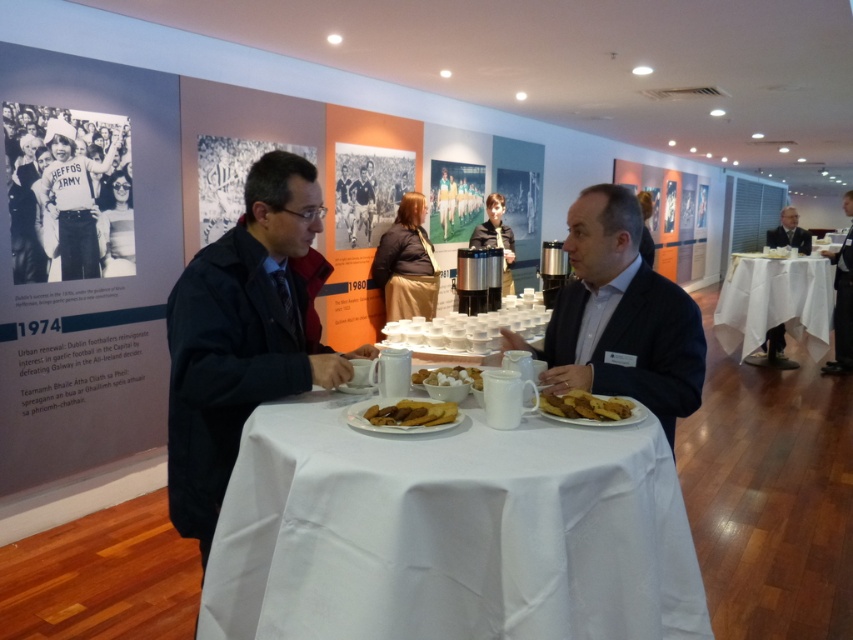
You are standing in the conference room and notice a white shirt at center. Based on its position, can you determine if it is closer to the front or the back of the room?

The white shirt at center is located at point 0.495 on the x and 0.728 on the y axis, which places it closer to the back of the room since the y coordinate is higher.

You are at a networking event in a room with historical panels. You see a golden crispy bread at center and a light brown wooden table at center. Which object is positioned to the left?

The golden crispy bread at center is to the left of the light brown wooden table at center.